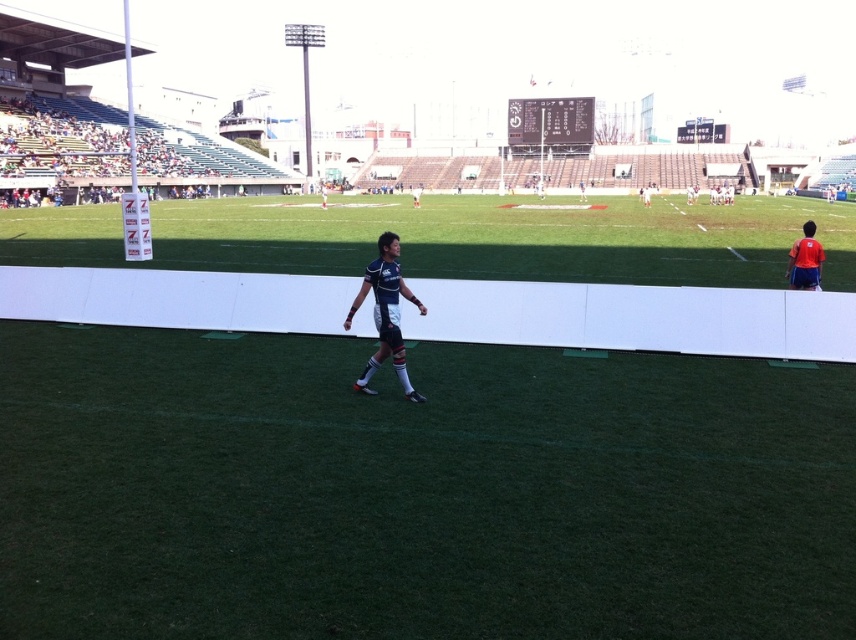
Is blue jersey at center positioned behind red fabric shirt at right?

No.

Does blue jersey at center have a lesser height compared to red fabric shirt at right?

Incorrect, blue jersey at center's height does not fall short of red fabric shirt at right's.

Image resolution: width=856 pixels, height=640 pixels. I want to click on blue jersey at center, so click(385, 314).